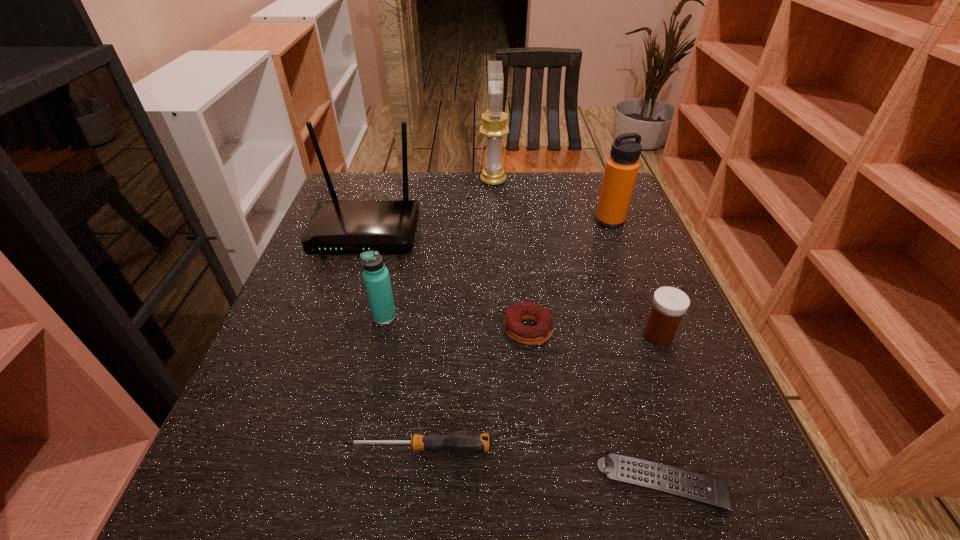
Find the location of a particular element. The width and height of the screenshot is (960, 540). the shortest object is located at coordinates (692, 486).

Image resolution: width=960 pixels, height=540 pixels. Identify the location of blank space located 0.170m on the front-facing side of the tallest object. tap(422, 181).

Where is `vacant region located on the front-facing side of the tallest object`? The width and height of the screenshot is (960, 540). vacant region located on the front-facing side of the tallest object is located at coordinates (364, 181).

Locate an element on the screen. free space located 0.090m on the front-facing side of the tallest object is located at coordinates (449, 181).

You are a GUI agent. You are given a task and a screenshot of the screen. Output one action in this format:
    pyautogui.click(x=<x>, y=<y>)
    Task: Click on the blank space located on the front-facing side of the router
    
    Given the screenshot: What is the action you would take?
    pyautogui.click(x=353, y=274)

The height and width of the screenshot is (540, 960). I want to click on free region located on the left of the right thermos bottle, so click(x=544, y=221).

Find the location of a particular element. The width and height of the screenshot is (960, 540). free location located 0.380m on the back of the nearer thermos bottle is located at coordinates (408, 207).

Where is `vacant space located 0.110m on the front of the medicine`? This screenshot has width=960, height=540. vacant space located 0.110m on the front of the medicine is located at coordinates (683, 397).

The height and width of the screenshot is (540, 960). What are the coordinates of `vacant space situated 0.310m on the back of the doughnut` in the screenshot? It's located at (516, 224).

The height and width of the screenshot is (540, 960). I want to click on vacant space located on the left of the screwdriver, so [x=287, y=448].